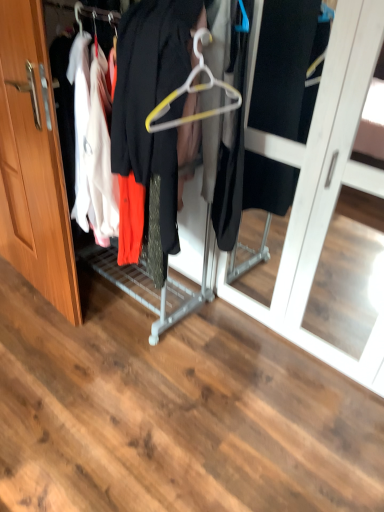
You are a GUI agent. You are given a task and a screenshot of the screen. Output one action in this format:
    pyautogui.click(x=<x>, y=<y>)
    Task: Click on the free space in front of wooden door at left
    This screenshot has height=512, width=384.
    Given the screenshot: What is the action you would take?
    pyautogui.click(x=38, y=347)